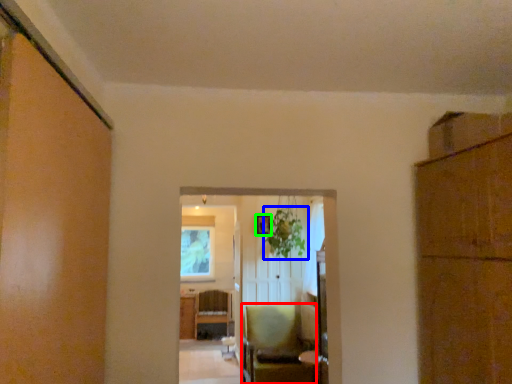
Question: Which object is positioned farthest from chair (highlighted by a red box)? Select from plant (highlighted by a blue box) and picture frame (highlighted by a green box).

Choices:
 (A) plant
 (B) picture frame

Answer: (B)